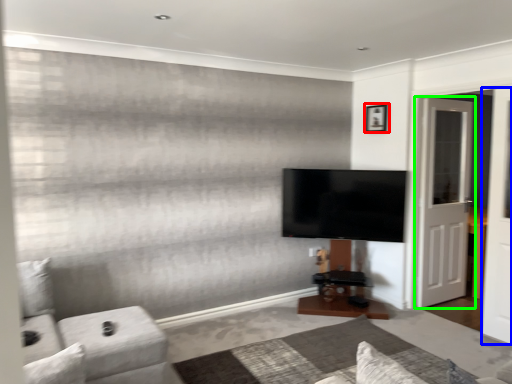
Question: Estimate the real-world distances between objects in this image. Which object is farther from picture frame (highlighted by a red box), screen door (highlighted by a blue box) or door (highlighted by a green box)?

Choices:
 (A) screen door
 (B) door

Answer: (A)